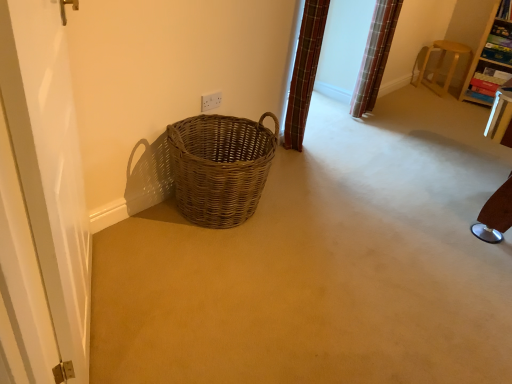
Question: From a real-world perspective, is white glossy screen door at left on top of light brown wooden stool at upper right, which is counted as the 2th furniture, starting from the right?

Choices:
 (A) yes
 (B) no

Answer: (A)

Question: Is white glossy screen door at left oriented towards light brown wooden stool at upper right, which is the 1th furniture in left-to-right order?

Choices:
 (A) no
 (B) yes

Answer: (A)

Question: Is white glossy screen door at left bigger than light brown wooden stool at upper right, which is counted as the 2th furniture, starting from the right?

Choices:
 (A) yes
 (B) no

Answer: (A)

Question: Is white glossy screen door at left closer to camera compared to light brown wooden stool at upper right, which is the 1th furniture in left-to-right order?

Choices:
 (A) no
 (B) yes

Answer: (B)

Question: Does white glossy screen door at left have a lesser width compared to light brown wooden stool at upper right, which is counted as the 2th furniture, starting from the right?

Choices:
 (A) no
 (B) yes

Answer: (B)

Question: Considering the relative positions of white glossy screen door at left and light brown wooden stool at upper right, which is counted as the 2th furniture, starting from the right, in the image provided, is white glossy screen door at left to the right of light brown wooden stool at upper right, which is counted as the 2th furniture, starting from the right, from the viewer's perspective?

Choices:
 (A) no
 (B) yes

Answer: (A)

Question: Considering the relative sizes of light brown wooden stool at upper right, which is counted as the 2th furniture, starting from the right, and white glossy screen door at left in the image provided, is light brown wooden stool at upper right, which is counted as the 2th furniture, starting from the right, wider than white glossy screen door at left?

Choices:
 (A) no
 (B) yes

Answer: (B)

Question: Can you confirm if light brown wooden stool at upper right, which is counted as the 2th furniture, starting from the right, is bigger than white glossy screen door at left?

Choices:
 (A) yes
 (B) no

Answer: (B)

Question: Is light brown wooden stool at upper right, which is counted as the 2th furniture, starting from the right, smaller than white glossy screen door at left?

Choices:
 (A) no
 (B) yes

Answer: (B)

Question: Considering the relative sizes of light brown wooden stool at upper right, which is the 1th furniture in left-to-right order, and white glossy screen door at left in the image provided, is light brown wooden stool at upper right, which is the 1th furniture in left-to-right order, shorter than white glossy screen door at left?

Choices:
 (A) no
 (B) yes

Answer: (B)

Question: Is light brown wooden stool at upper right, which is the 1th furniture in left-to-right order, to the left of white glossy screen door at left from the viewer's perspective?

Choices:
 (A) yes
 (B) no

Answer: (B)

Question: Is there a large distance between light brown wooden stool at upper right, which is counted as the 2th furniture, starting from the right, and white glossy screen door at left?

Choices:
 (A) yes
 (B) no

Answer: (A)

Question: Is white glossy screen door at left thinner than wooden bookshelf at upper right, acting as the 1th furniture starting from the right?

Choices:
 (A) no
 (B) yes

Answer: (B)